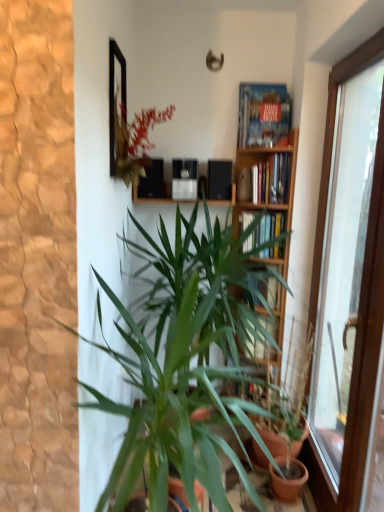
Question: Is wooden bookshelf at upper center, marked as the 2th book in a top-to-bottom arrangement, bigger or smaller than hardcover books at center, which is the first book from bottom to top?

Choices:
 (A) small
 (B) big

Answer: (A)

Question: From a real-world perspective, relative to hardcover books at center, which is the first book from bottom to top, is wooden bookshelf at upper center, the second book positioned from the bottom, vertically above or below?

Choices:
 (A) above
 (B) below

Answer: (A)

Question: Based on their relative distances, which object is farther from the transparent glass door at right?

Choices:
 (A) hardcover books at center, acting as the 3th book starting from the top
 (B) wooden bookshelf at center
 (C) blue hardcover book at upper right, the 1th book viewed from the top
 (D) wooden bookshelf at upper center, marked as the 2th book in a top-to-bottom arrangement
 (E) matte black speakers at upper center

Answer: (E)

Question: Which object is the farthest from the green leafy plant at lower right, positioned as the first houseplant in right-to-left order?

Choices:
 (A) wooden bookshelf at upper center, marked as the 2th book in a top-to-bottom arrangement
 (B) blue hardcover book at upper right, the 1th book viewed from the top
 (C) matte black speakers at upper center
 (D) hardcover books at center, acting as the 3th book starting from the top
 (E) wooden bookshelf at center

Answer: (B)